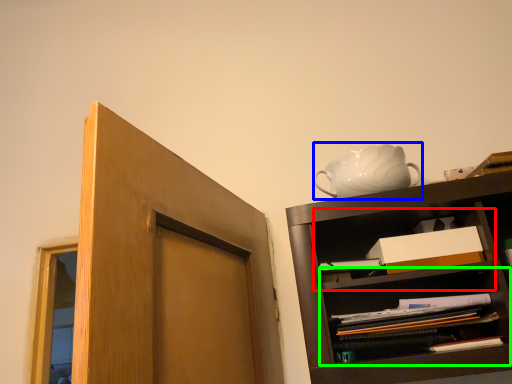
Question: Considering the real-world distances, which object is farthest from cabinet (highlighted by a red box)? tea pot (highlighted by a blue box) or shelf (highlighted by a green box)?

Choices:
 (A) tea pot
 (B) shelf

Answer: (A)